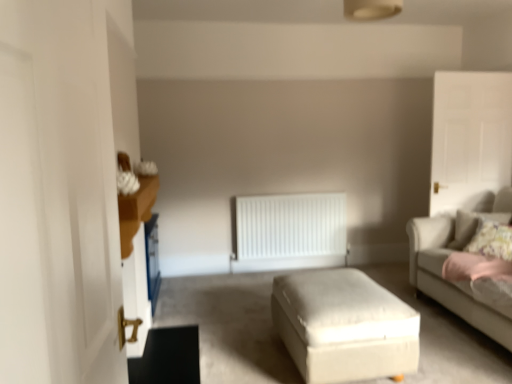
Question: Is white matte radiator at center in front of or behind white glossy door at upper right, the first glass door from the back, in the image?

Choices:
 (A) front
 (B) behind

Answer: (B)

Question: Is point (302, 240) closer or farther from the camera than point (505, 89)?

Choices:
 (A) closer
 (B) farther

Answer: (B)

Question: Which of these objects is positioned farthest from the white glossy door at upper right, acting as the 2th glass door starting from the left?

Choices:
 (A) fluffy floral pillow at right
 (B) white fabric ottoman at center
 (C) beige fabric couch at right
 (D) white matte radiator at center
 (E) white glossy door at left, which is the first glass door from left to right

Answer: (E)

Question: Which of these objects is positioned closest to the white glossy door at upper right, acting as the 2th glass door starting from the front?

Choices:
 (A) fluffy floral pillow at right
 (B) beige fabric couch at right
 (C) white glossy door at left, which is the first glass door from left to right
 (D) white fabric ottoman at center
 (E) white matte radiator at center

Answer: (B)